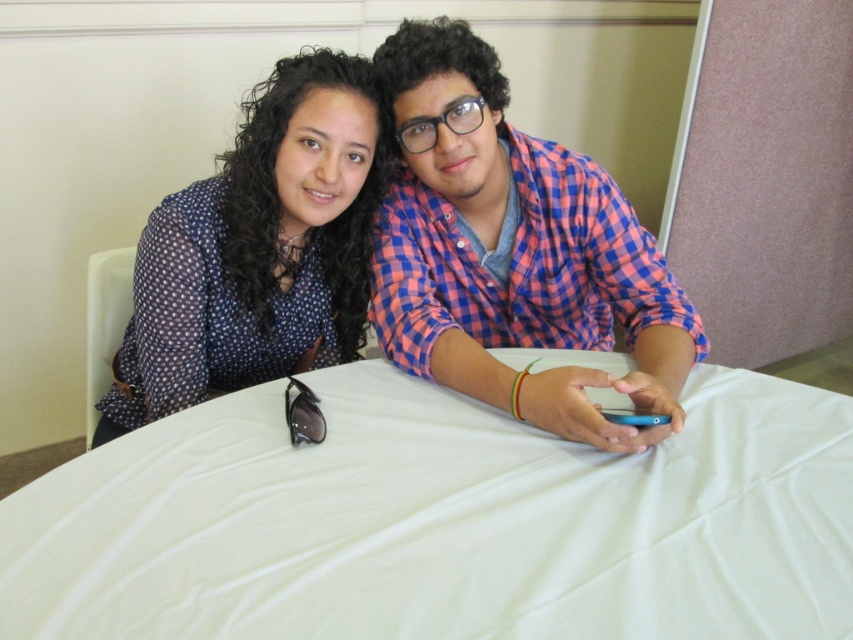
Is matte blue blouse at upper left to the right of black plastic goggles at lower center from the viewer's perspective?

Incorrect, matte blue blouse at upper left is not on the right side of black plastic goggles at lower center.

Who is more distant from viewer, (254,241) or (308,401)?

The point (254,241) is more distant.

Measure the distance between point (244, 193) and camera.

Point (244, 193) is 1.17 meters from camera.

You are a GUI agent. You are given a task and a screenshot of the screen. Output one action in this format:
    pyautogui.click(x=<x>, y=<y>)
    Task: Click on the matte blue blouse at upper left
    
    Given the screenshot: What is the action you would take?
    pyautogui.click(x=258, y=248)

Is matte blue shirt at center shorter than black plastic goggles at lower center?

In fact, matte blue shirt at center may be taller than black plastic goggles at lower center.

In the scene shown: Who is positioned more to the right, matte blue shirt at center or black plastic goggles at lower center?

Positioned to the right is matte blue shirt at center.

Who is more forward, (x=492, y=93) or (x=305, y=401)?

Point (x=305, y=401)

At what (x,y) coordinates should I click in order to perform the action: click on matte blue shirt at center. Please return your answer as a coordinate pair (x, y). The image size is (853, 640). Looking at the image, I should click on (514, 252).

Between white cloth at center and matte blue blouse at upper left, which one has more height?

Standing taller between the two is matte blue blouse at upper left.

Can you confirm if white cloth at center is positioned below matte blue blouse at upper left?

Indeed, white cloth at center is positioned under matte blue blouse at upper left.

This screenshot has height=640, width=853. I want to click on white cloth at center, so click(x=442, y=522).